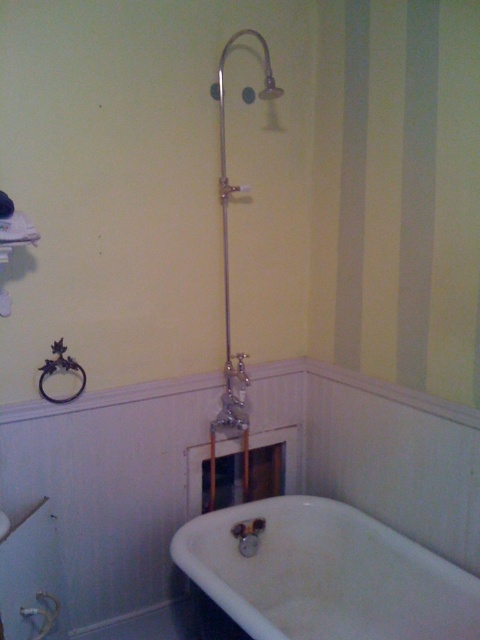
Is white glossy bathtub at lower center behind polished chrome shower at center?

No, it is in front of polished chrome shower at center.

Does point (342, 508) come behind point (265, 84)?

Yes, it is behind point (265, 84).

The width and height of the screenshot is (480, 640). What are the coordinates of `white glossy bathtub at lower center` in the screenshot? It's located at (325, 573).